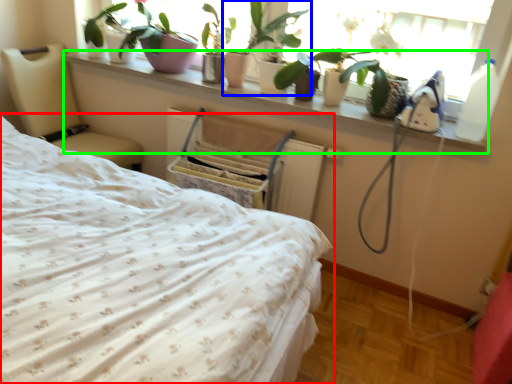
Question: Considering the real-world distances, which object is closest to bed (highlighted by a red box)? houseplant (highlighted by a blue box) or ledge (highlighted by a green box).

Choices:
 (A) houseplant
 (B) ledge

Answer: (B)